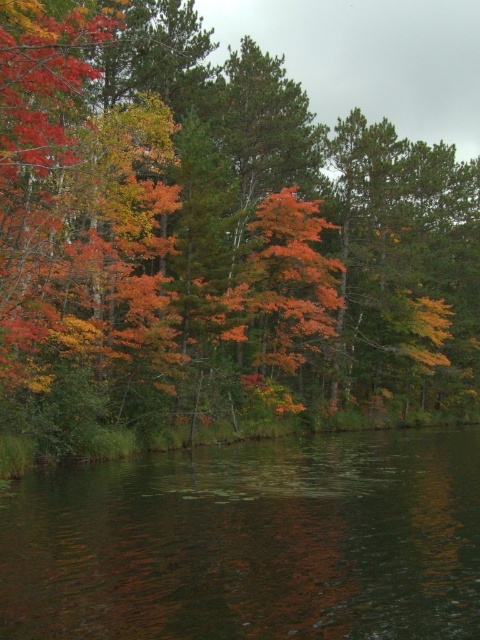
You are standing at the edge of the lake and see the orange leafy tree at center and the dark reflective water at lower center. Which object is located to the right of the other?

The orange leafy tree at center is positioned on the right side of dark reflective water at lower center.

You are standing at the edge of the water in the scene. If you want to walk directly towards the orange leafy tree at center, which direction should you head?

Since the orange leafy tree at center is located at coordinates 0.369 on the x axis and 0.446 on the y axis, you should walk towards the center of the image to reach it.